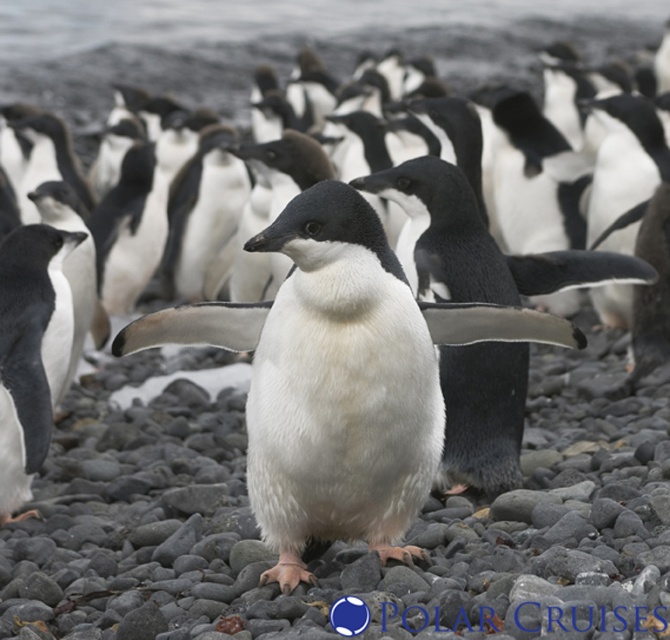
Does white matte penguin at center have a lesser width compared to white matte penguin at left?

No, white matte penguin at center is not thinner than white matte penguin at left.

Is white matte penguin at center further to the viewer compared to white matte penguin at left?

That is False.

Is point (259, 346) less distant than point (23, 464)?

Yes, it is in front of point (23, 464).

Where is `white matte penguin at center`? This screenshot has height=640, width=670. white matte penguin at center is located at coordinates (338, 378).